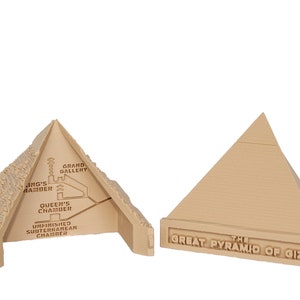
Identify the location of interior. This screenshot has height=300, width=300. (108, 225).